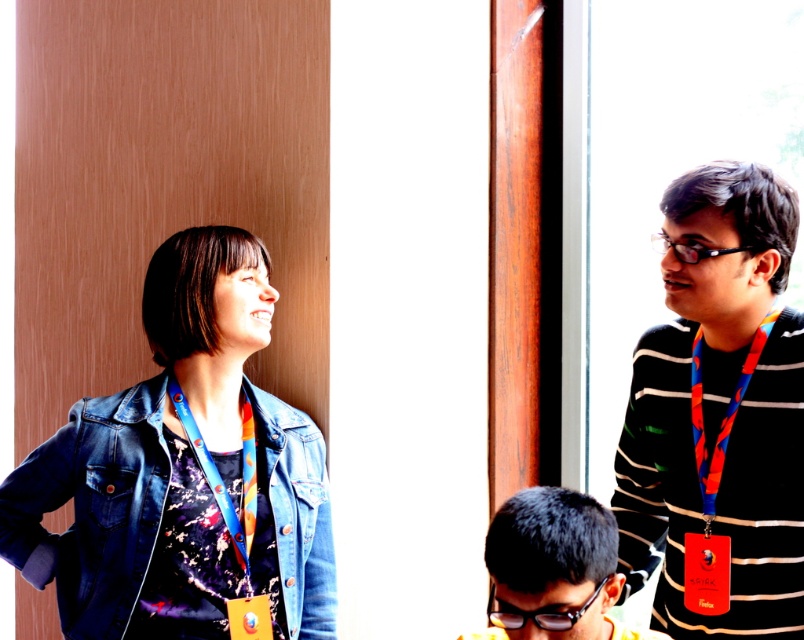
Question: Which point is farther from the camera taking this photo?

Choices:
 (A) (688, 364)
 (B) (253, 493)

Answer: (B)

Question: Among these objects, which one is nearest to the camera?

Choices:
 (A) black textured hair at lower center
 (B) striped sweater at right
 (C) denim jacket at left

Answer: (A)

Question: Can you confirm if denim jacket at left is positioned to the right of black textured hair at lower center?

Choices:
 (A) yes
 (B) no

Answer: (B)

Question: Is black textured hair at lower center bigger than blue fabric lanyard at left?

Choices:
 (A) yes
 (B) no

Answer: (A)

Question: Which object is closer to the camera taking this photo?

Choices:
 (A) striped sweater at right
 (B) black textured hair at lower center

Answer: (B)

Question: Is striped sweater at right smaller than black textured hair at lower center?

Choices:
 (A) yes
 (B) no

Answer: (B)